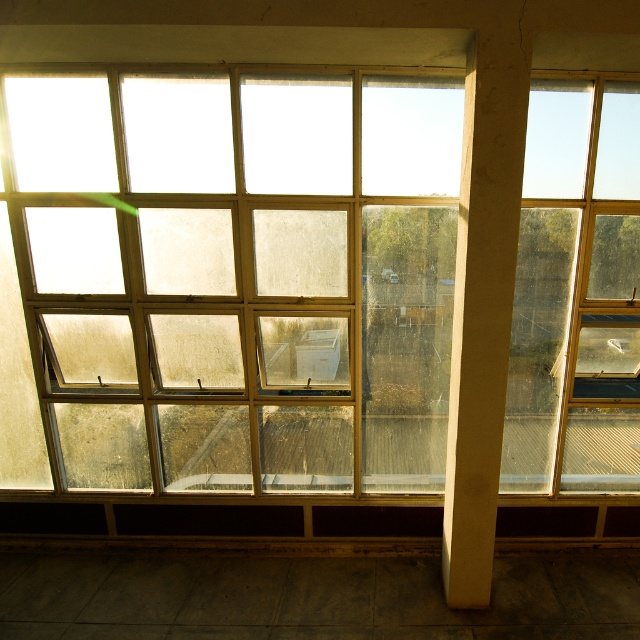
Can you confirm if clear glass window at center is taller than white concrete pillar at center?

Incorrect, clear glass window at center's height is not larger of white concrete pillar at center's.

Between clear glass window at center and white concrete pillar at center, which one appears on the left side from the viewer's perspective?

Positioned to the left is clear glass window at center.

Who is more forward, (236, 148) or (524, 99)?

Point (524, 99) is in front.

In order to click on clear glass window at center in this screenshot , I will do `click(228, 280)`.